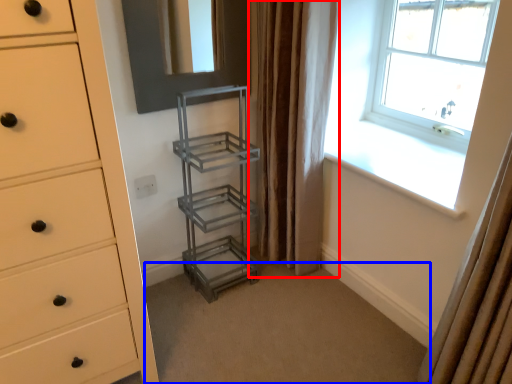
Question: Among these objects, which one is nearest to the camera, curtain (highlighted by a red box) or plain (highlighted by a blue box)?

Choices:
 (A) curtain
 (B) plain

Answer: (B)